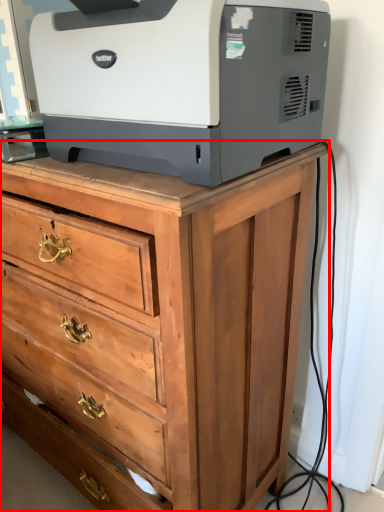
Question: In this image, where is chest of drawers (annotated by the red box) located relative to printer?

Choices:
 (A) right
 (B) left

Answer: (B)